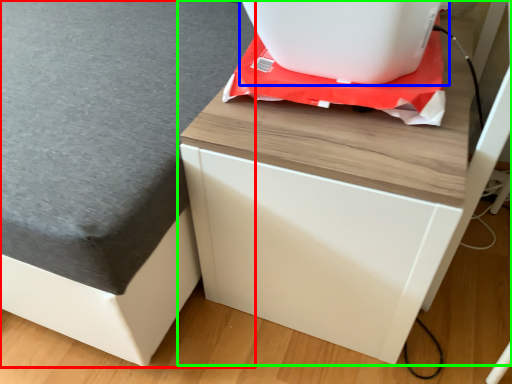
Question: Which is nearer to the table top (highlighted by a red box)? appliance (highlighted by a blue box) or furniture (highlighted by a green box).

Choices:
 (A) appliance
 (B) furniture

Answer: (B)